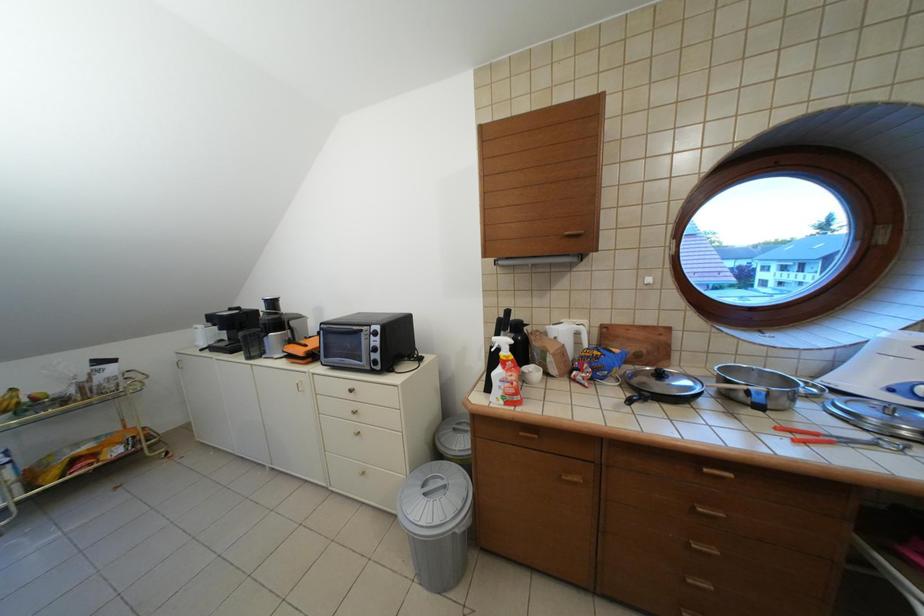
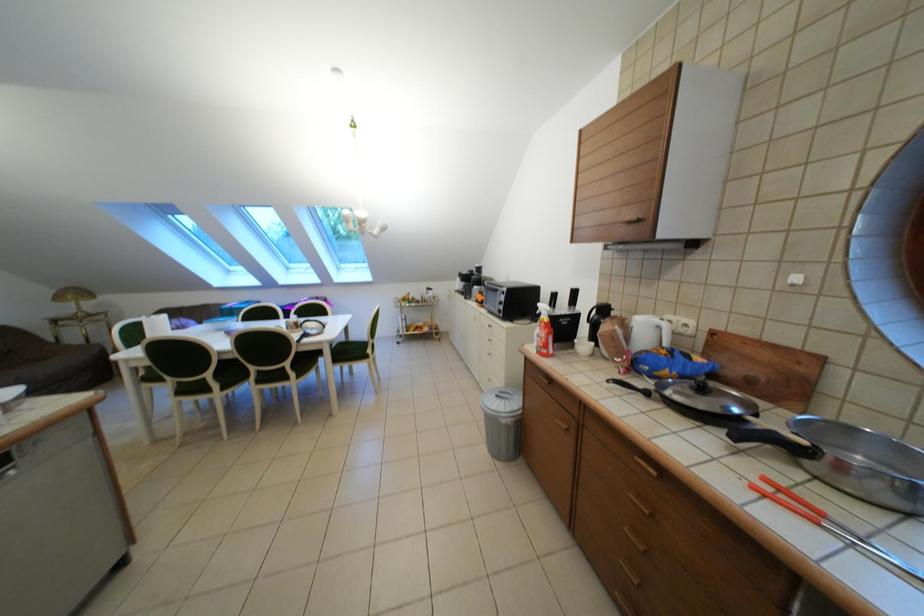
Question: The images are taken continuously from a first-person perspective. In which direction is your viewpoint rotating?

Choices:
 (A) Left
 (B) Right
 (C) Up
 (D) Down

Answer: (A)